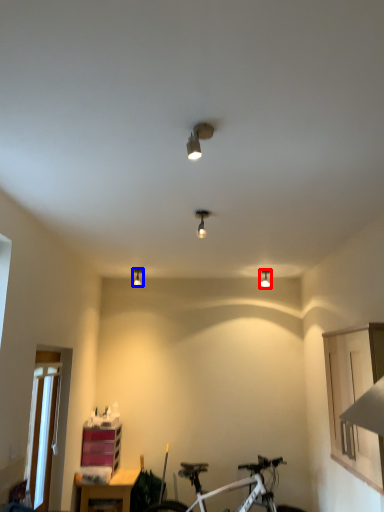
Question: Which of the following is the closest to the observer, light fixture (highlighted by a red box) or light fixture (highlighted by a blue box)?

Choices:
 (A) light fixture
 (B) light fixture

Answer: (A)